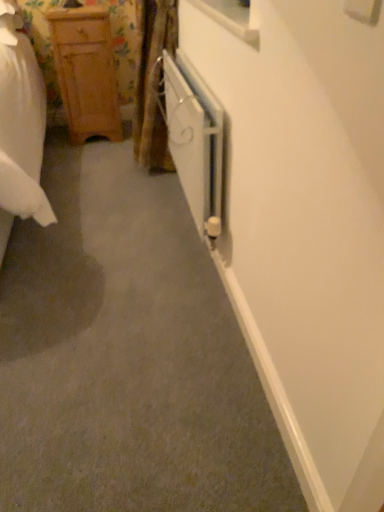
Question: Is wooden cabinet at left shorter than white matte radiator at center?

Choices:
 (A) no
 (B) yes

Answer: (A)

Question: Could white matte radiator at center be considered to be inside wooden cabinet at left?

Choices:
 (A) no
 (B) yes

Answer: (A)

Question: Would you consider wooden cabinet at left to be distant from white matte radiator at center?

Choices:
 (A) no
 (B) yes

Answer: (A)

Question: Considering the relative sizes of wooden cabinet at left and white matte radiator at center in the image provided, is wooden cabinet at left wider than white matte radiator at center?

Choices:
 (A) yes
 (B) no

Answer: (A)

Question: From the image's perspective, is wooden cabinet at left over white matte radiator at center?

Choices:
 (A) no
 (B) yes

Answer: (B)

Question: From a real-world perspective, is wooden cabinet at left located beneath white matte radiator at center?

Choices:
 (A) no
 (B) yes

Answer: (B)

Question: From the image's perspective, is white matte radiator at center located above wooden cabinet at left?

Choices:
 (A) no
 (B) yes

Answer: (A)

Question: Is white matte radiator at center thinner than wooden cabinet at left?

Choices:
 (A) yes
 (B) no

Answer: (A)

Question: Is white matte radiator at center not within wooden cabinet at left?

Choices:
 (A) yes
 (B) no

Answer: (A)

Question: From a real-world perspective, is white matte radiator at center located higher than wooden cabinet at left?

Choices:
 (A) yes
 (B) no

Answer: (A)

Question: Does white matte radiator at center appear on the right side of wooden cabinet at left?

Choices:
 (A) yes
 (B) no

Answer: (A)

Question: Considering the relative sizes of white matte radiator at center and wooden cabinet at left in the image provided, is white matte radiator at center wider than wooden cabinet at left?

Choices:
 (A) yes
 (B) no

Answer: (B)

Question: In the image, is white matte radiator at center on the left side or the right side of wooden cabinet at left?

Choices:
 (A) right
 (B) left

Answer: (A)